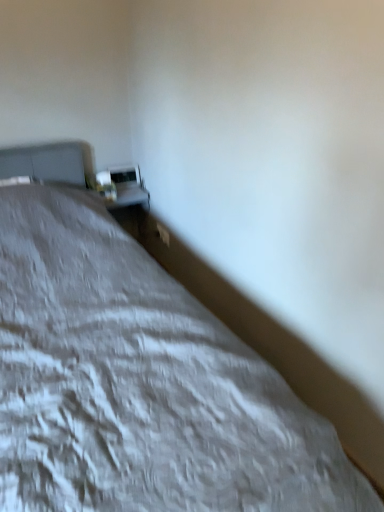
Question: In the image, is white glossy table at upper center on the left side or the right side of matte white table lamp at upper left?

Choices:
 (A) right
 (B) left

Answer: (A)

Question: Relative to matte white table lamp at upper left, is white glossy table at upper center in front or behind?

Choices:
 (A) front
 (B) behind

Answer: (B)

Question: Which object is positioned farthest from the matte white table lamp at upper left?

Choices:
 (A) white textured bed at center
 (B) white glossy table at upper center

Answer: (A)

Question: Estimate the real-world distances between objects in this image. Which object is closer to the white textured bed at center?

Choices:
 (A) white glossy table at upper center
 (B) matte white table lamp at upper left

Answer: (B)